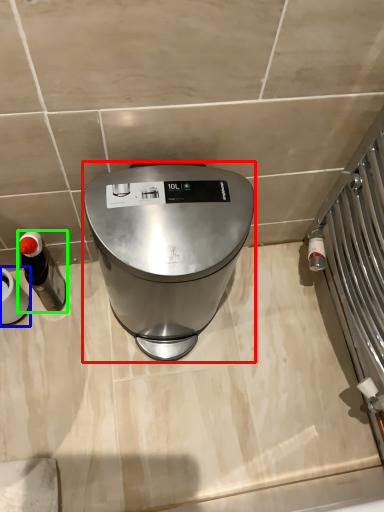
Question: Estimate the real-world distances between objects in this image. Which object is closer to home appliance (highlighted by a red box), appliance (highlighted by a blue box) or appliance (highlighted by a green box)?

Choices:
 (A) appliance
 (B) appliance

Answer: (B)